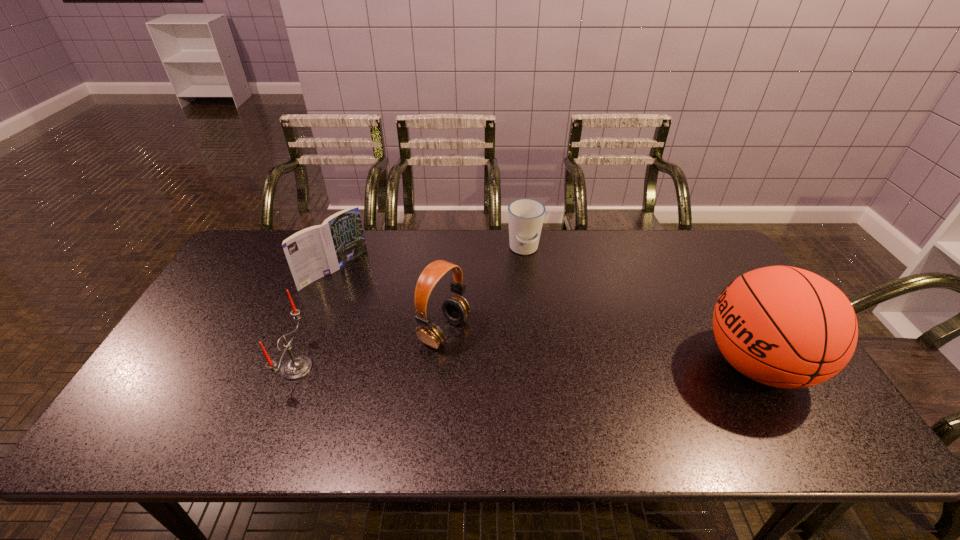
At what (x,y) coordinates should I click in order to perform the action: click on candle. Please return your answer as a coordinate pair (x, y). This screenshot has width=960, height=540. Looking at the image, I should click on (296, 367).

The image size is (960, 540). Find the location of `the tallest object`. the tallest object is located at coordinates tap(786, 327).

Find the location of a particular element. the rightmost object is located at coordinates click(786, 327).

Image resolution: width=960 pixels, height=540 pixels. Find the location of `the second object from right to left`. the second object from right to left is located at coordinates (525, 216).

In order to click on headset in this screenshot , I will do `click(455, 309)`.

The width and height of the screenshot is (960, 540). What are the coordinates of `book` in the screenshot? It's located at (314, 252).

This screenshot has height=540, width=960. In order to click on free location located on the front-facing side of the candle in this screenshot , I will do `click(161, 368)`.

You are a GUI agent. You are given a task and a screenshot of the screen. Output one action in this format:
    pyautogui.click(x=<x>, y=<y>)
    Task: Click on the vacant space located on the front-facing side of the candle
    Image resolution: width=960 pixels, height=540 pixels.
    Given the screenshot: What is the action you would take?
    pyautogui.click(x=251, y=368)

Find the location of a particular element. The width and height of the screenshot is (960, 540). vacant space situated on the front-facing side of the candle is located at coordinates (220, 368).

Identify the location of free space located 0.200m on the side with logo of the basketball. (623, 364).